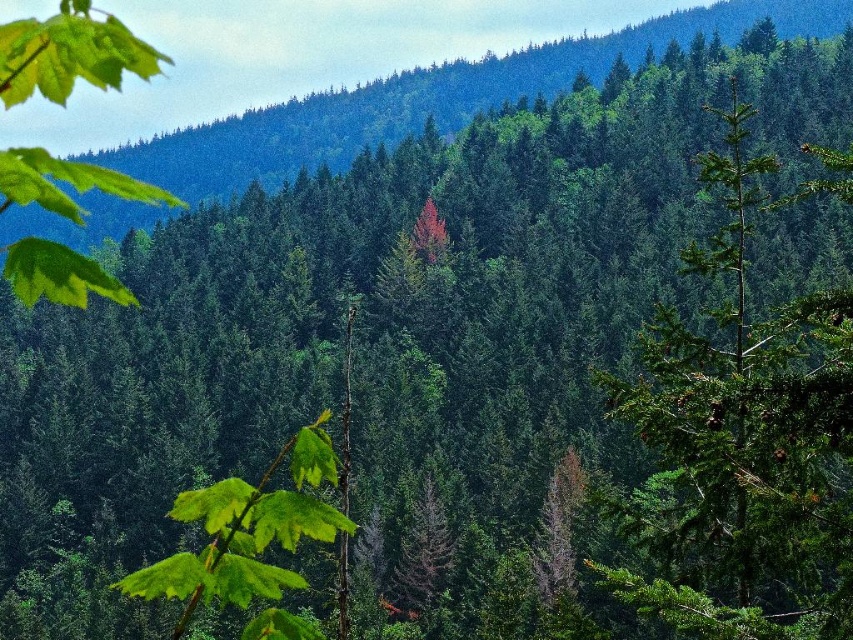
Question: Which point appears farthest from the camera in this image?

Choices:
 (A) (734, 496)
 (B) (13, 291)
 (C) (126, 211)

Answer: (C)

Question: Which object appears farthest from the camera in this image?

Choices:
 (A) green needle-like tree at right
 (B) green matte forest at center

Answer: (B)

Question: Can you confirm if green matte forest at center is positioned below green matte leaf at upper left?

Choices:
 (A) no
 (B) yes

Answer: (A)

Question: Does green matte forest at center lie in front of green matte leaf at upper left?

Choices:
 (A) yes
 (B) no

Answer: (B)

Question: Can you confirm if green needle-like tree at right is smaller than green matte forest at center?

Choices:
 (A) yes
 (B) no

Answer: (A)

Question: Estimate the real-world distances between objects in this image. Which object is farther from the green matte leaf at upper left?

Choices:
 (A) green matte forest at center
 (B) green needle-like tree at right

Answer: (A)